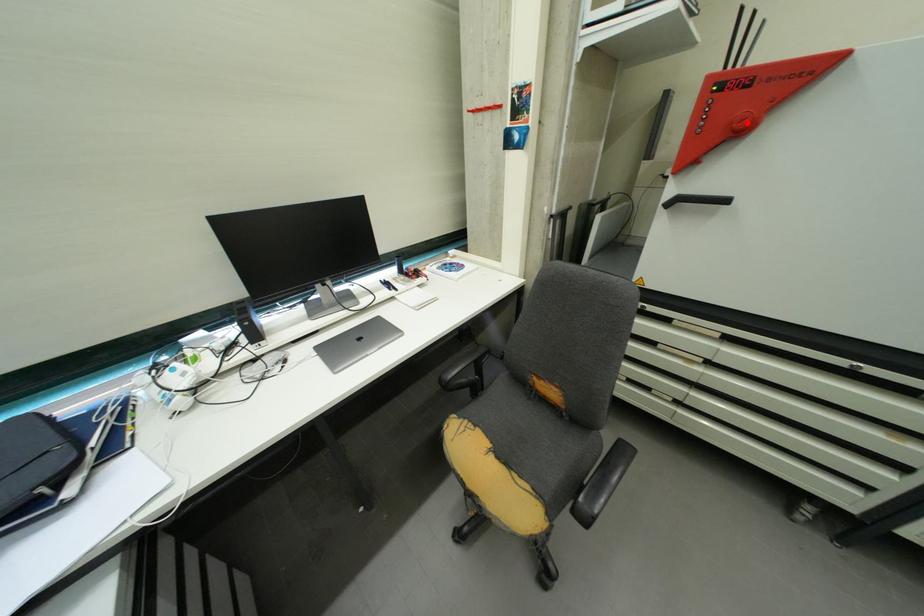
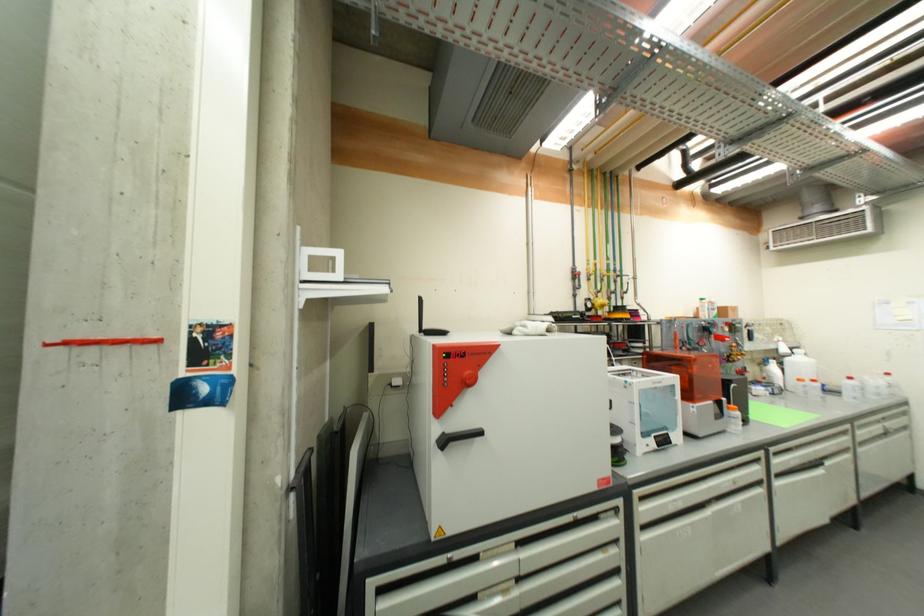
Where in the second image is the point corresponding to the highlighted location from the first image?

(476, 381)